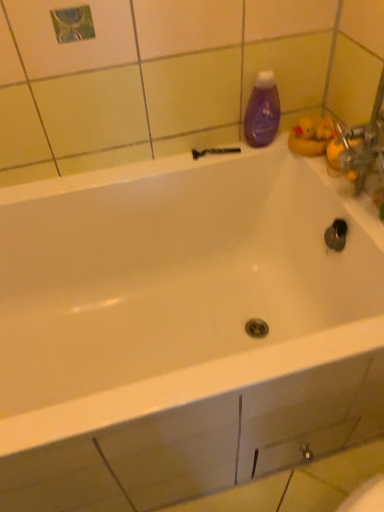
Question: In terms of size, does purple glossy bottle at upper right appear bigger or smaller than black plastic shower at upper center?

Choices:
 (A) big
 (B) small

Answer: (A)

Question: Considering the positions of purple glossy bottle at upper right and black plastic shower at upper center in the image, is purple glossy bottle at upper right taller or shorter than black plastic shower at upper center?

Choices:
 (A) short
 (B) tall

Answer: (B)

Question: Relative to black plastic shower at upper center, is purple glossy bottle at upper right in front or behind?

Choices:
 (A) behind
 (B) front

Answer: (B)

Question: Is black plastic shower at upper center wider or thinner than purple glossy bottle at upper right?

Choices:
 (A) wide
 (B) thin

Answer: (B)

Question: Would you say black plastic shower at upper center is to the left or to the right of purple glossy bottle at upper right in the picture?

Choices:
 (A) right
 (B) left

Answer: (B)

Question: Is point (198, 155) positioned closer to the camera than point (256, 144)?

Choices:
 (A) farther
 (B) closer

Answer: (A)

Question: From the image's perspective, relative to purple glossy bottle at upper right, is black plastic shower at upper center above or below?

Choices:
 (A) below
 (B) above

Answer: (A)